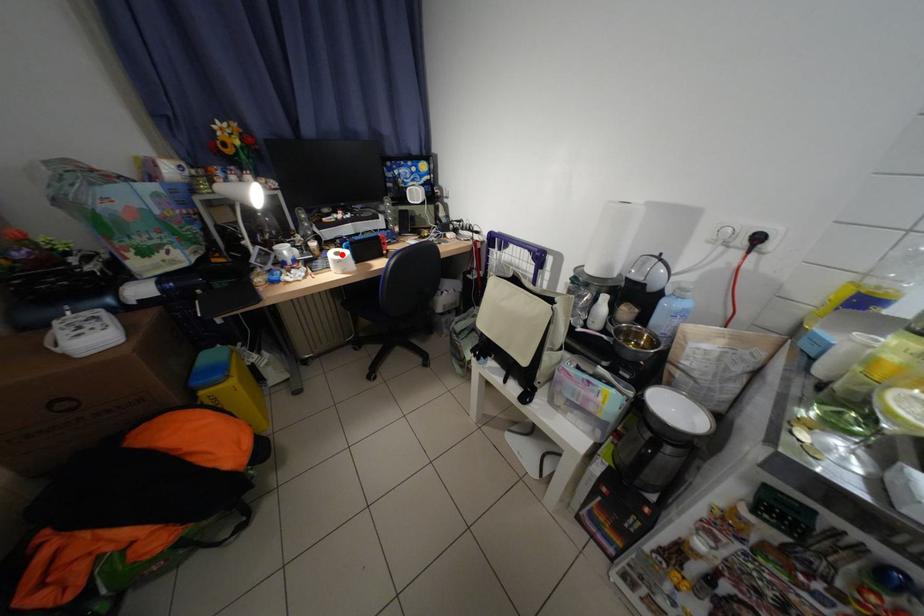
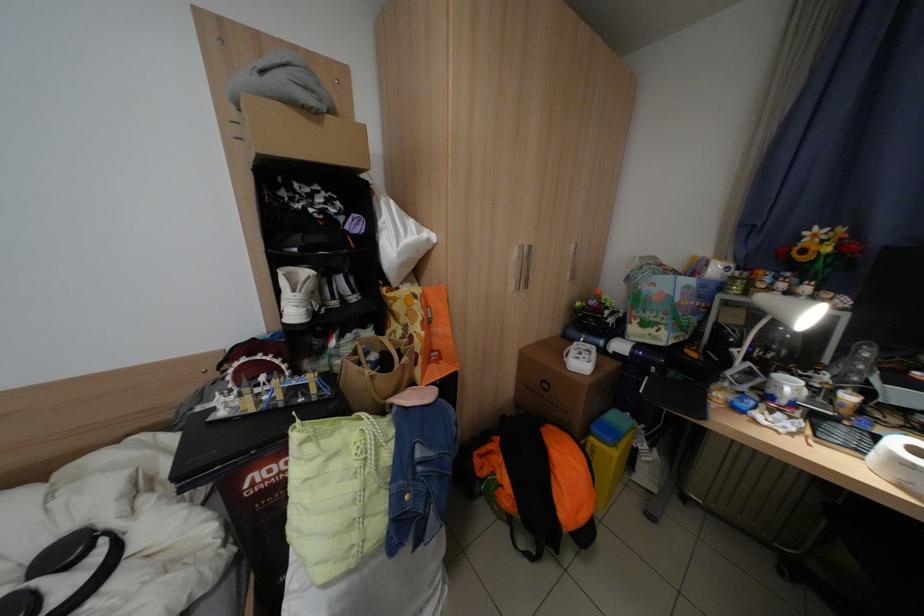
Where in the second image is the point corresponding to the highlighted location from the first image?

(906, 442)